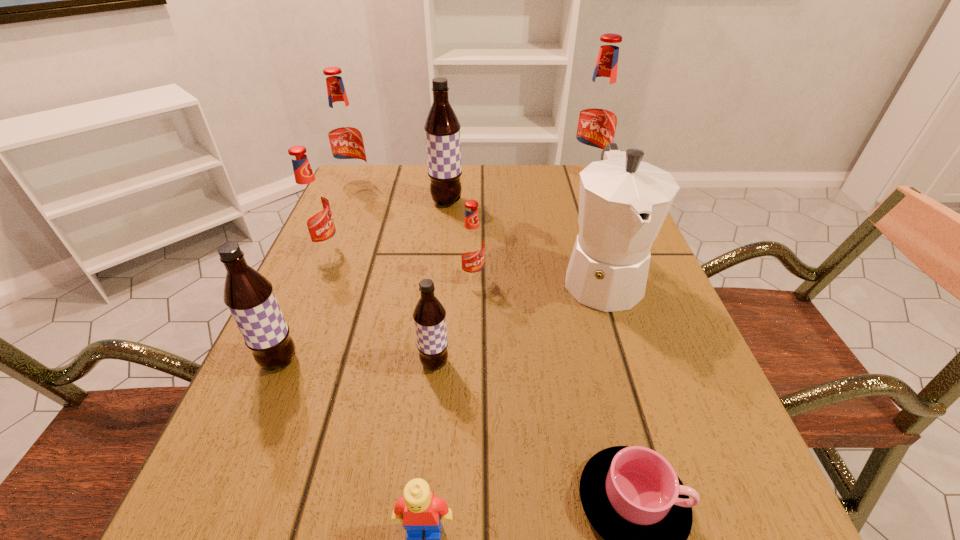
This screenshot has width=960, height=540. I want to click on coffeepot that is at the right edge, so click(623, 202).

At what (x,y) coordinates should I click in order to perform the action: click on object that is at the far left corner. Please return your answer as a coordinate pair (x, y). This screenshot has width=960, height=540. Looking at the image, I should click on (345, 137).

This screenshot has height=540, width=960. Identify the location of object situated at the far right corner. (597, 119).

Image resolution: width=960 pixels, height=540 pixels. Find the location of `free space at the far edge`. free space at the far edge is located at coordinates (546, 164).

Identify the location of vacant space at the left edge of the desktop. The height and width of the screenshot is (540, 960). (350, 258).

This screenshot has width=960, height=540. What are the coordinates of `free space at the right edge` in the screenshot? It's located at (651, 433).

In the image, there is a desktop. Where is `vacant space at the far left corner`? This screenshot has height=540, width=960. vacant space at the far left corner is located at coordinates (369, 207).

In the image, there is a desktop. At what (x,y) coordinates should I click in order to perform the action: click on free space at the far right corner. Please return your answer as a coordinate pair (x, y). The height and width of the screenshot is (540, 960). Looking at the image, I should click on (557, 173).

Find the location of `empty space that is in between the biggest brown root beer and the leftmost brown root beer`. empty space that is in between the biggest brown root beer and the leftmost brown root beer is located at coordinates (363, 282).

Where is `unoccupied area between the farthest brown root beer and the third red root beer from left to right`? The image size is (960, 540). unoccupied area between the farthest brown root beer and the third red root beer from left to right is located at coordinates (460, 240).